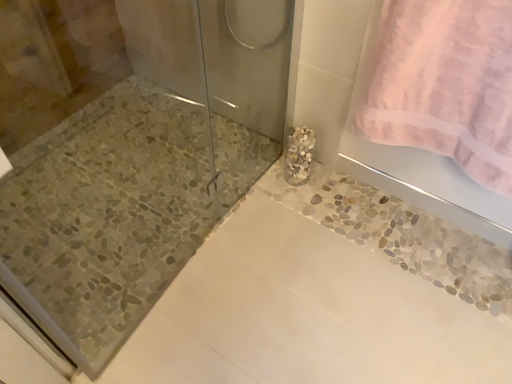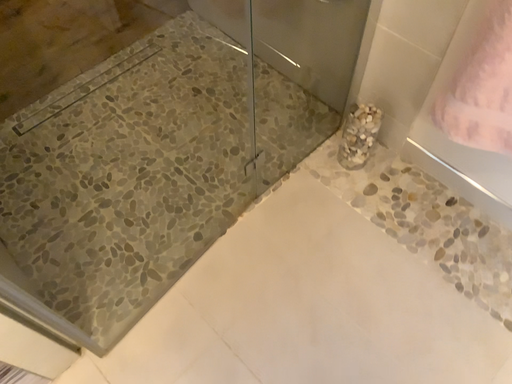
Question: How did the camera likely rotate when shooting the video?

Choices:
 (A) rotated right
 (B) rotated left

Answer: (B)